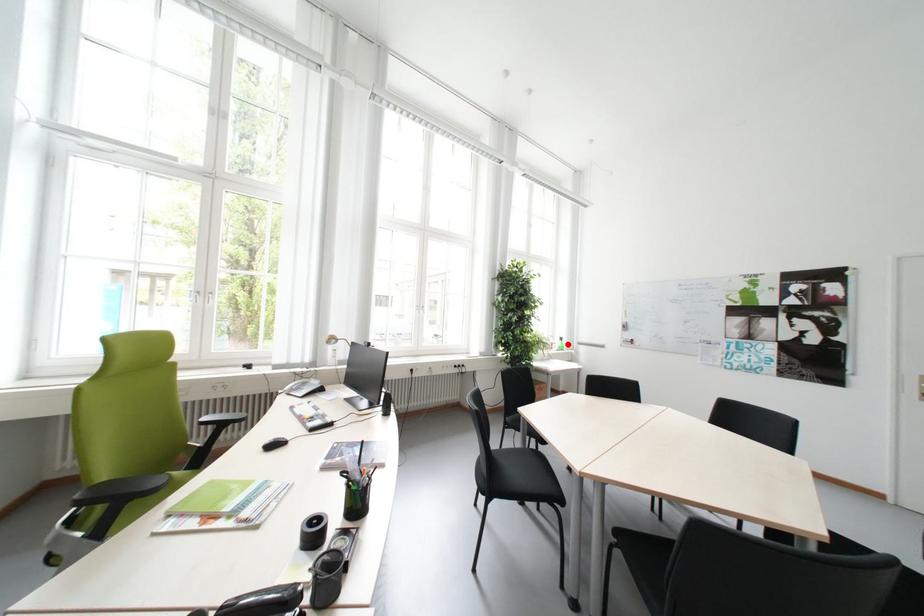
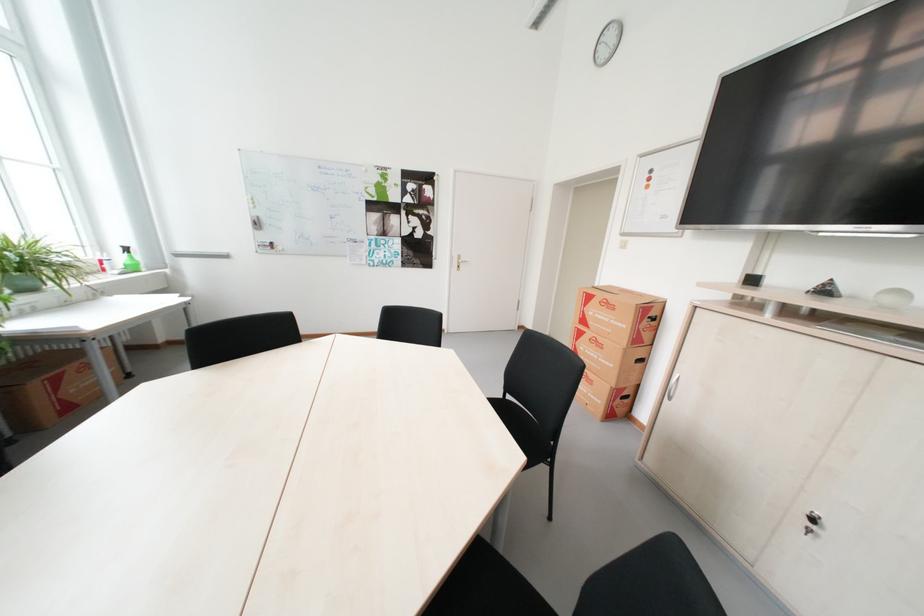
In the second image, find the point that corresponds to the highlighted location in the first image.

(130, 260)